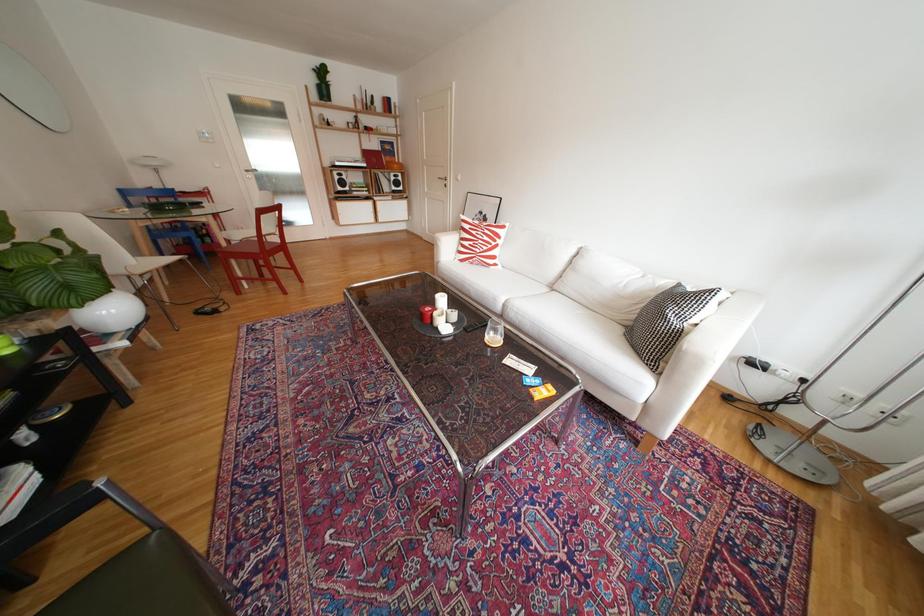
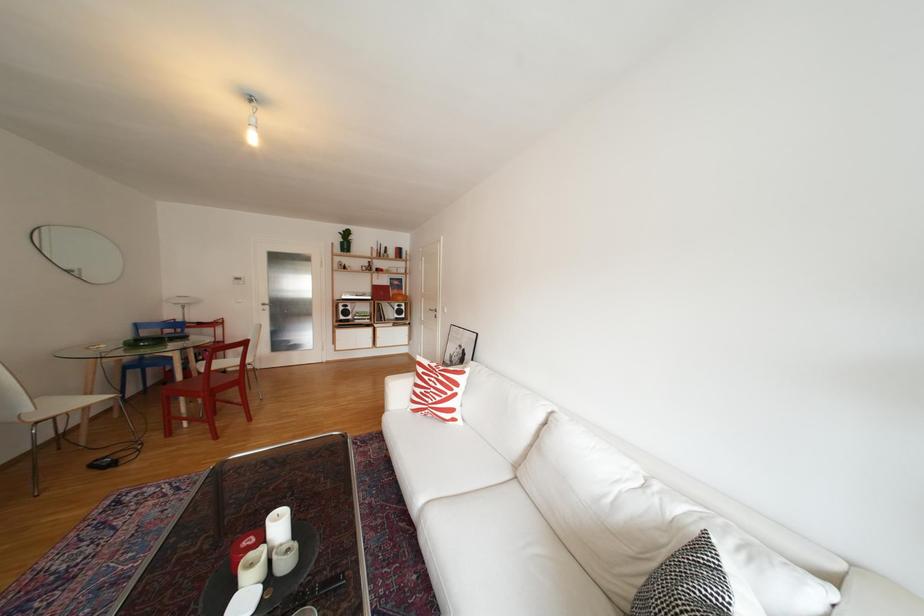
Question: The first image is from the beginning of the video and the second image is from the end. How did the camera likely rotate when shooting the video?

Choices:
 (A) Left
 (B) Right
 (C) Up
 (D) Down

Answer: (C)